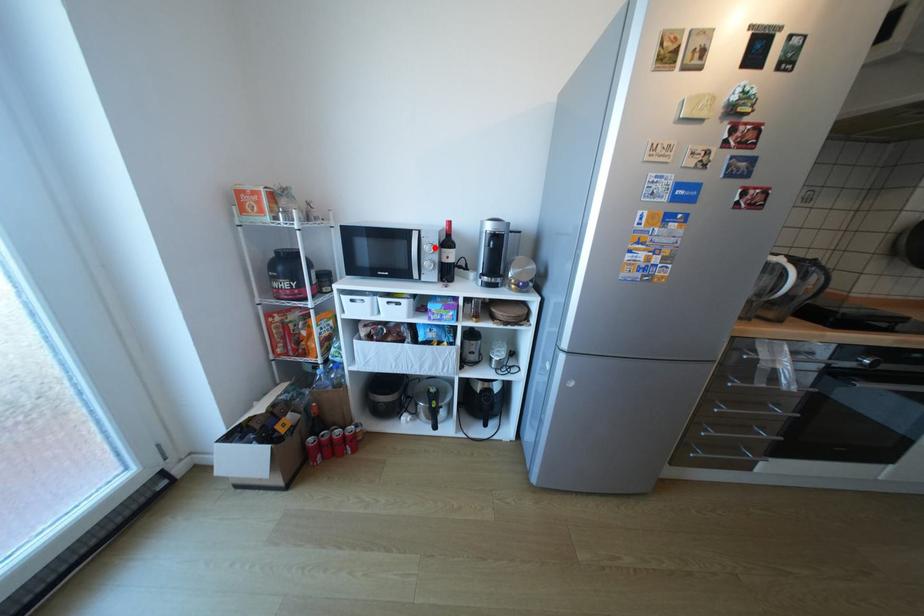
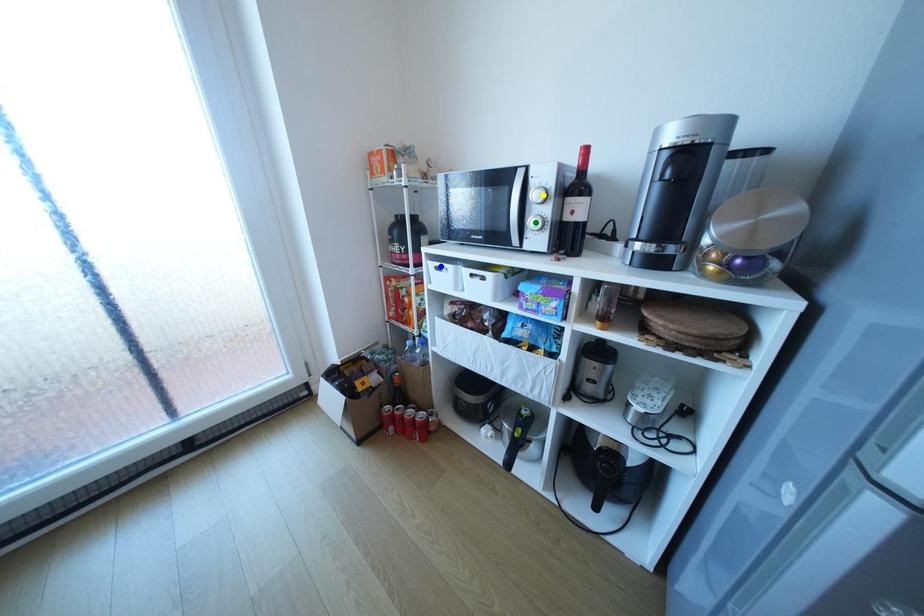
Question: I am providing you with two images of the same scene from different viewpoints. A red point is marked on the first image. You are given multiple points on the second image. Can you choose the point in image 2 that corresponds to the point in image 1?

Choices:
 (A) yellow point
 (B) blue point
 (C) green point

Answer: (A)